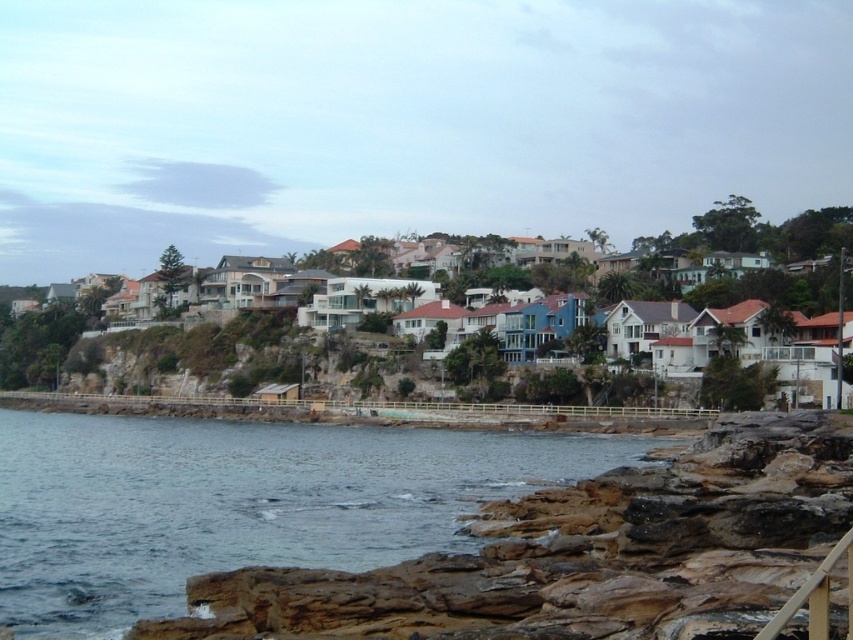
Question: Can you confirm if blue water at lower left is positioned to the left of white matte houses at center?

Choices:
 (A) no
 (B) yes

Answer: (B)

Question: Is blue water at lower left below white matte houses at center?

Choices:
 (A) no
 (B) yes

Answer: (B)

Question: Can you confirm if blue water at lower left is thinner than white matte houses at center?

Choices:
 (A) no
 (B) yes

Answer: (B)

Question: Which point is farther to the camera?

Choices:
 (A) white matte houses at center
 (B) blue water at lower left

Answer: (A)